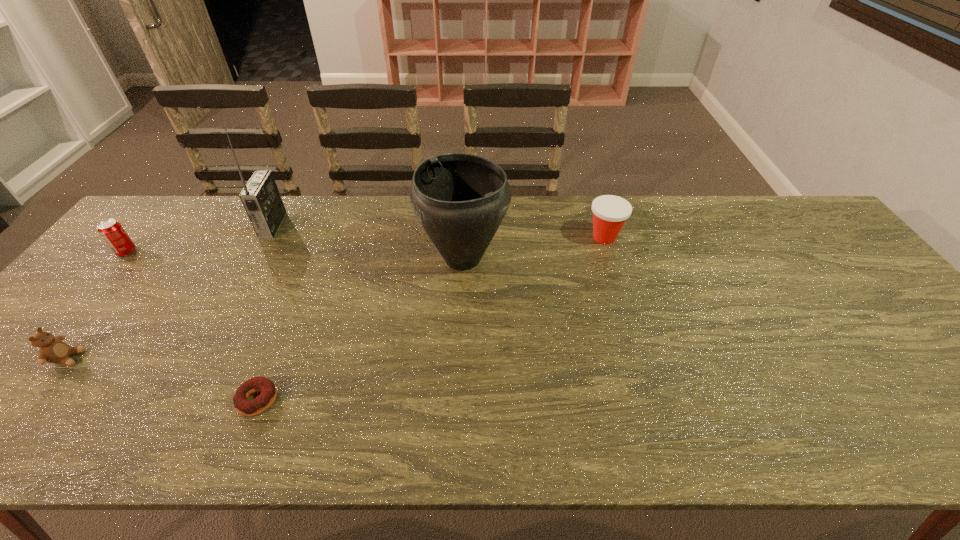
What are the coordinates of `free space that satisfies the following two spatial constraints: 1. on the display of the fifth object from left to right; 2. on the left side of the third object from left to right` in the screenshot? It's located at (255, 258).

I want to click on vacant space that satisfies the following two spatial constraints: 1. on the display of the second object from right to left; 2. on the left side of the radio receiver, so click(255, 258).